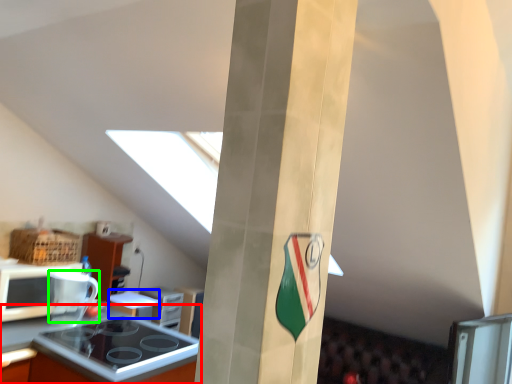
Question: Based on their relative distances, which object is farther from countertop (highlighted by a red box)? Choose from appliance (highlighted by a blue box) and appliance (highlighted by a green box).

Choices:
 (A) appliance
 (B) appliance

Answer: (A)